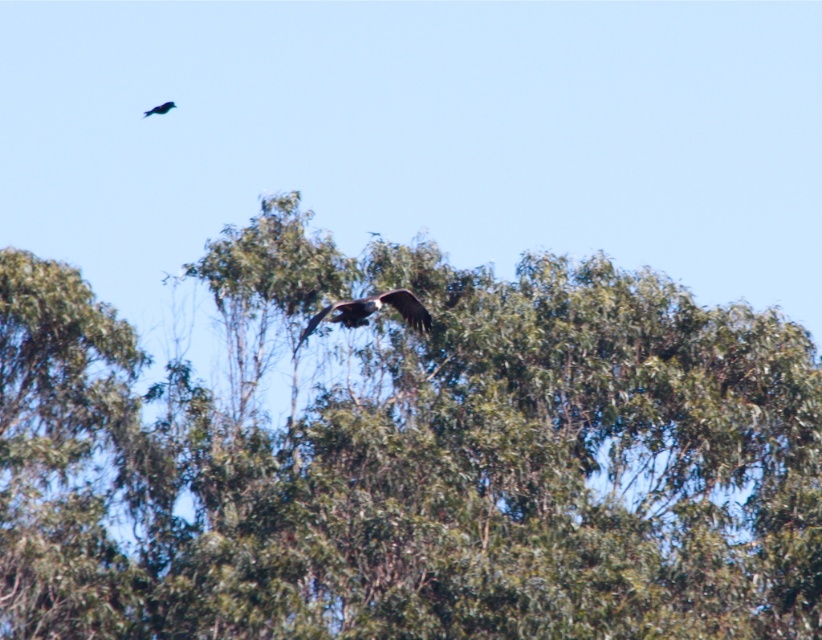
Question: Which of the following is the closest to the observer?

Choices:
 (A) green leafy tree at center
 (B) brown feathered eagle at center

Answer: (A)

Question: Is green leafy tree at center positioned before shiny black bird at upper left?

Choices:
 (A) yes
 (B) no

Answer: (A)

Question: Can you confirm if green leafy tree at center is positioned to the right of shiny black bird at upper left?

Choices:
 (A) yes
 (B) no

Answer: (A)

Question: Which point is farther to the camera?

Choices:
 (A) brown feathered eagle at center
 (B) green leafy tree at center
 (C) shiny black bird at upper left

Answer: (C)

Question: Considering the real-world distances, which object is closest to the brown feathered eagle at center?

Choices:
 (A) green leafy tree at center
 (B) shiny black bird at upper left

Answer: (A)

Question: Can you confirm if green leafy tree at center is bigger than brown feathered eagle at center?

Choices:
 (A) no
 (B) yes

Answer: (B)